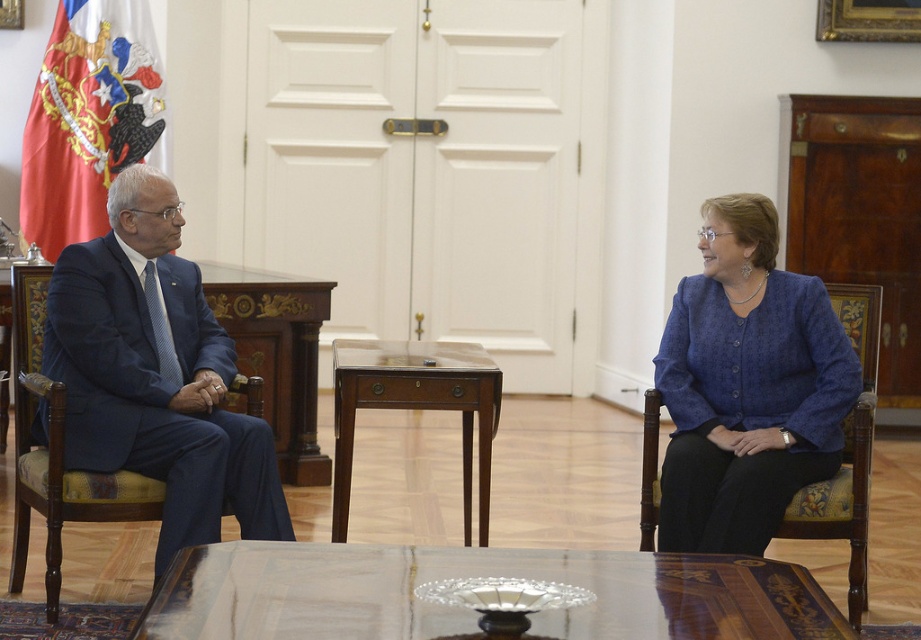
Consider the image. Does blue textured blazer at right appear on the left side of mahogany wood side table at center?

Incorrect, blue textured blazer at right is not on the left side of mahogany wood side table at center.

The height and width of the screenshot is (640, 921). I want to click on blue textured blazer at right, so click(x=747, y=387).

This screenshot has height=640, width=921. Find the location of `blue textured blazer at right`. blue textured blazer at right is located at coordinates (747, 387).

Is matte blue suit at left to the right of wooden polished table at center from the viewer's perspective?

No, matte blue suit at left is not to the right of wooden polished table at center.

Does matte blue suit at left appear under wooden polished table at center?

No, matte blue suit at left is not below wooden polished table at center.

Identify the location of matte blue suit at left. (156, 374).

This screenshot has height=640, width=921. What do you see at coordinates (156, 374) in the screenshot?
I see `matte blue suit at left` at bounding box center [156, 374].

Which of these two, matte blue suit at left or blue textured blazer at right, stands shorter?

Standing shorter between the two is blue textured blazer at right.

Between point (64, 266) and point (707, 429), which one is positioned in front?

Point (64, 266) is in front.

Locate an element on the screen. This screenshot has width=921, height=640. matte blue suit at left is located at coordinates (156, 374).